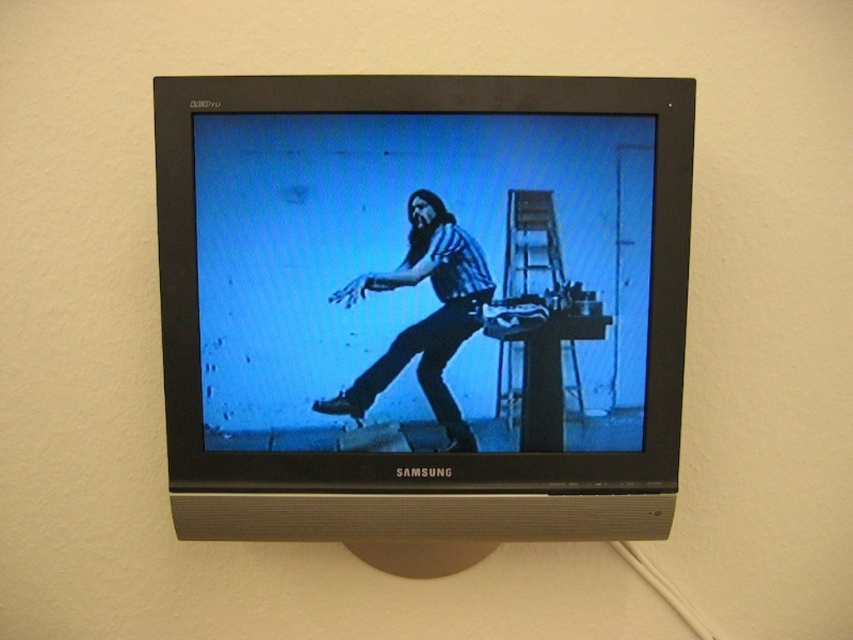
You are standing in a room with a Samsung CRT television mounted on the wall. You notice a matte black monitor at center and a matte blue jeans at center. Which object is closer to you?

The matte black monitor at center is closer to you because it is in front of the matte blue jeans at center.

You are trying to hang a picture frame that is 1.2 meters tall on the wall where the matte black monitor at center and the matte blue jeans at center are located. Based on their heights, which object would you need to move to make space for the frame?

The matte black monitor at center is much taller than the matte blue jeans at center, so you would need to move the matte black monitor at center to make space for the picture frame that is 1.2 meters tall.